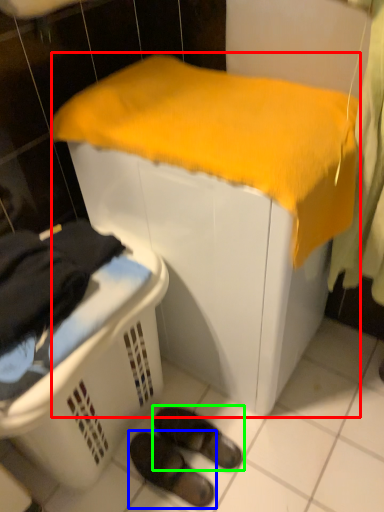
Question: Which object is positioned closest to furniture (highlighted by a red box)? Select from footwear (highlighted by a blue box) and footwear (highlighted by a green box).

Choices:
 (A) footwear
 (B) footwear

Answer: (B)